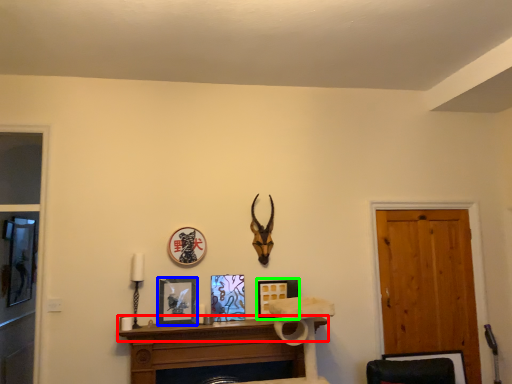
Question: Estimate the real-world distances between objects in this image. Which object is farther from mantle (highlighted by a red box), picture frame (highlighted by a blue box) or picture frame (highlighted by a green box)?

Choices:
 (A) picture frame
 (B) picture frame

Answer: (B)